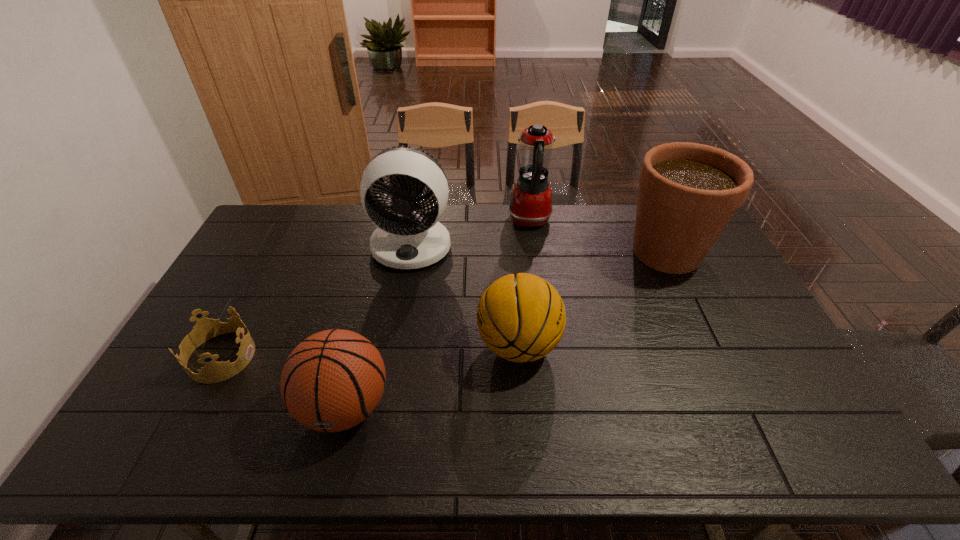
This screenshot has width=960, height=540. Identify the location of object located at the left edge. (213, 372).

The height and width of the screenshot is (540, 960). Identify the location of object present at the right edge. (688, 192).

Image resolution: width=960 pixels, height=540 pixels. Find the location of `object that is at the far right corner`. object that is at the far right corner is located at coordinates (688, 192).

In order to click on vacant space at the far edge in this screenshot , I will do point(535,228).

You are a GUI agent. You are given a task and a screenshot of the screen. Output one action in this format:
    pyautogui.click(x=<x>, y=<y>)
    Task: Click on the vacant point at the near edge
    This screenshot has width=960, height=540.
    Given the screenshot: What is the action you would take?
    pyautogui.click(x=492, y=433)

Locate an element on the screen. vacant space at the left edge is located at coordinates (280, 268).

In the image, there is a desktop. Identify the location of vacant space at the right edge. (710, 276).

Identify the location of vacant space at the far left corner of the desktop. Image resolution: width=960 pixels, height=540 pixels. [289, 231].

Locate an element on the screen. The height and width of the screenshot is (540, 960). free area in between the rightmost object and the food processor is located at coordinates (598, 236).

Locate an element on the screen. free space between the food processor and the fan is located at coordinates (470, 233).